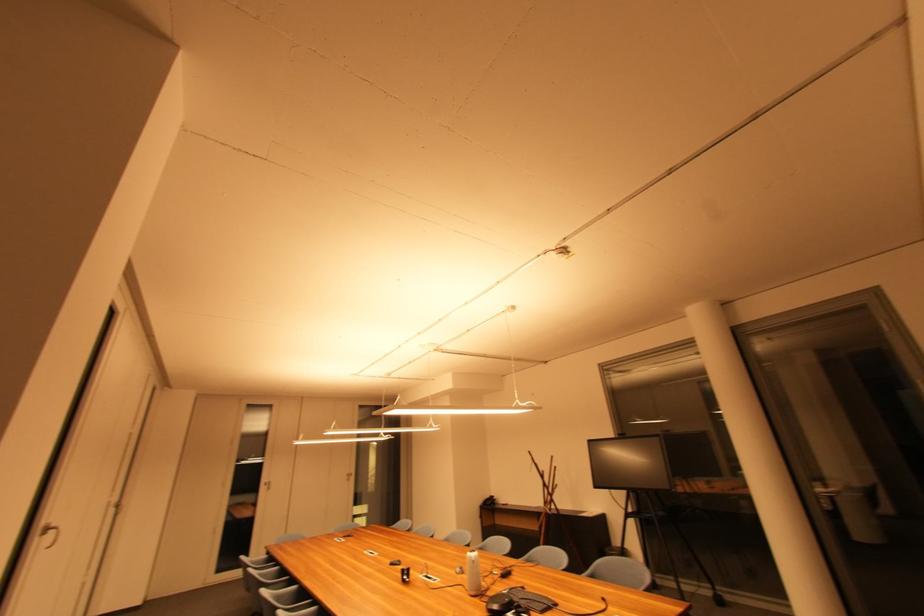
Find where to pull the white door handle. Please return your answer as a coordinate pair (x, y).

(50, 533)